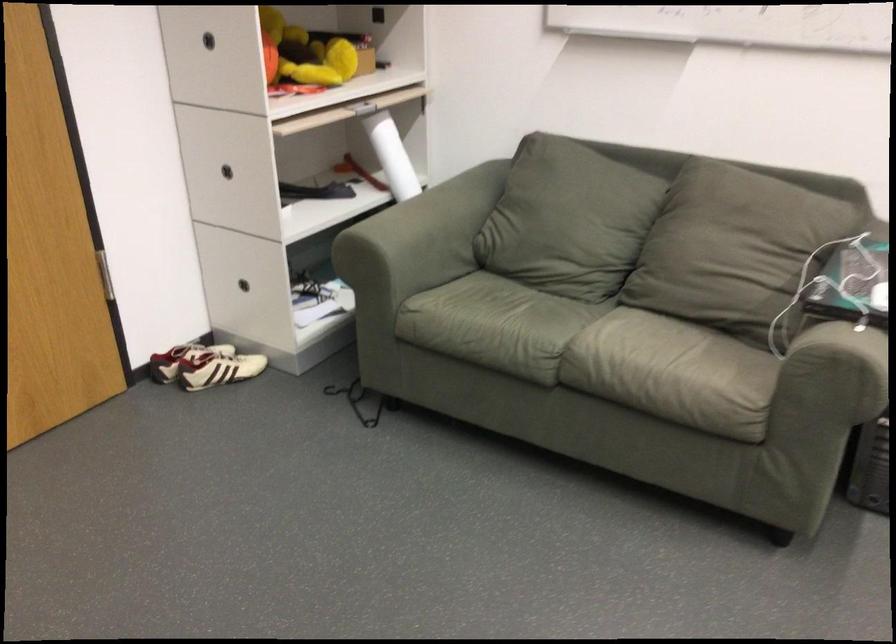
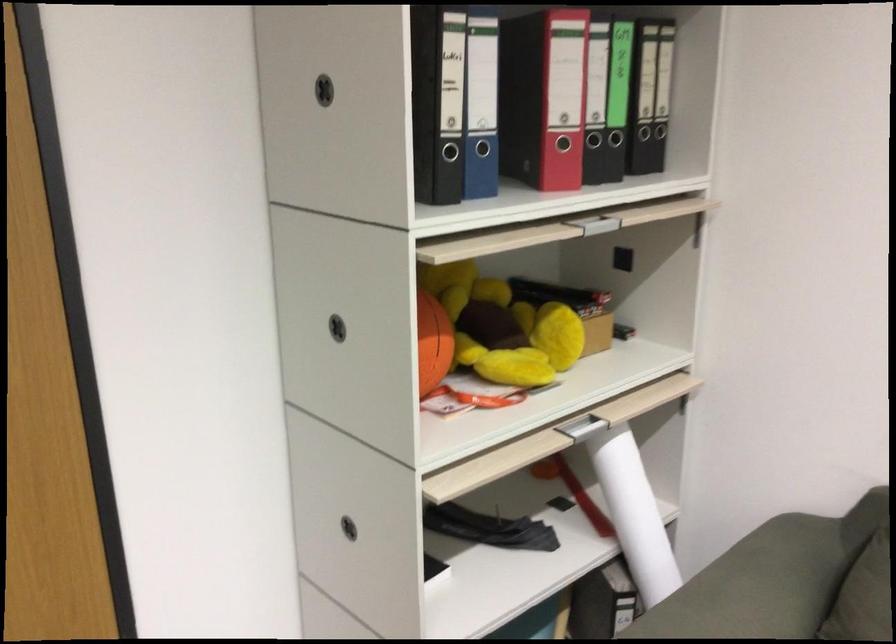
Locate, in the second image, the point that corresponds to point 228,178 in the first image.

(348, 527)